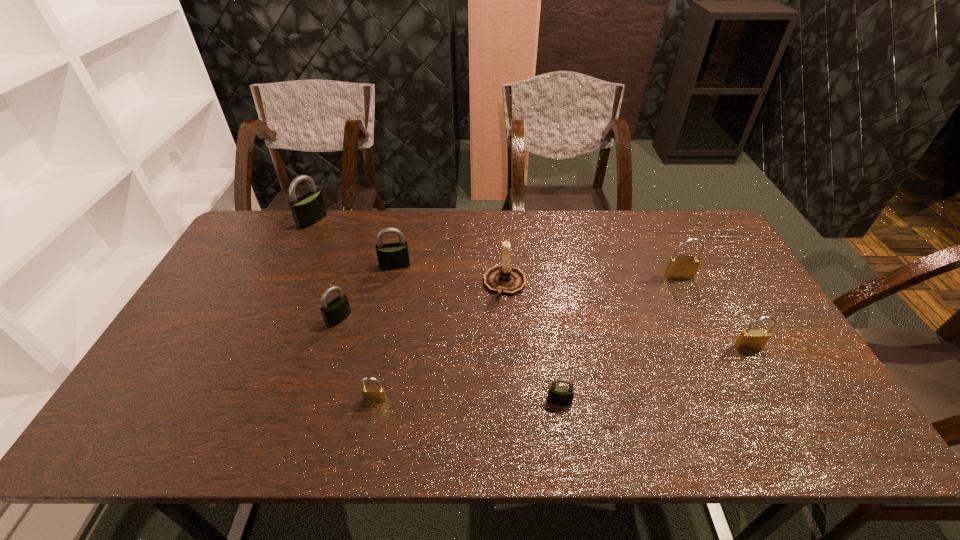
Where is `the sixth farthest object`? The width and height of the screenshot is (960, 540). the sixth farthest object is located at coordinates (749, 339).

Identify the location of the rightmost padlock. (749, 339).

The width and height of the screenshot is (960, 540). In order to click on the fifth padlock from left to right in this screenshot , I will do `click(559, 395)`.

In order to click on the nearest black padlock in this screenshot , I will do `click(559, 395)`.

Where is `the nearest brass padlock`? This screenshot has height=540, width=960. the nearest brass padlock is located at coordinates (373, 394).

Identify the location of the leftmost brass padlock. (373, 394).

Locate an element on the screen. vacant region located 0.370m on the right of the tallest padlock is located at coordinates (427, 221).

This screenshot has width=960, height=540. In order to click on free location located 0.310m on the front of the candle holder in this screenshot , I will do `click(512, 393)`.

Where is `vacant area situated 0.330m on the front-facing side of the fifth nearest padlock`? This screenshot has height=540, width=960. vacant area situated 0.330m on the front-facing side of the fifth nearest padlock is located at coordinates (723, 368).

The width and height of the screenshot is (960, 540). I want to click on vacant region located 0.300m on the left of the second biggest black padlock, so click(286, 266).